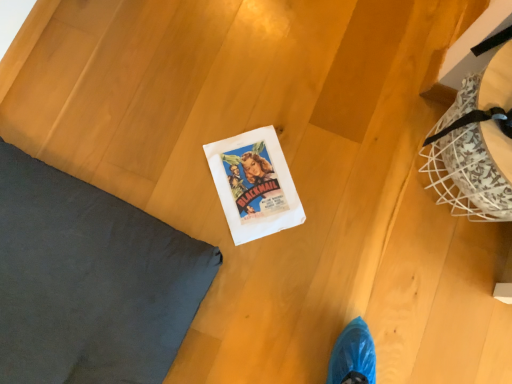
Question: Considering the relative sizes of white paper comic book at center and dark gray fabric pillow at upper left in the image provided, is white paper comic book at center taller than dark gray fabric pillow at upper left?

Choices:
 (A) yes
 (B) no

Answer: (B)

Question: Is white paper comic book at center aimed at dark gray fabric pillow at upper left?

Choices:
 (A) no
 (B) yes

Answer: (A)

Question: Is white paper comic book at center to the right of dark gray fabric pillow at upper left from the viewer's perspective?

Choices:
 (A) yes
 (B) no

Answer: (A)

Question: From the image's perspective, is white paper comic book at center beneath dark gray fabric pillow at upper left?

Choices:
 (A) yes
 (B) no

Answer: (B)

Question: Does white paper comic book at center have a smaller size compared to dark gray fabric pillow at upper left?

Choices:
 (A) no
 (B) yes

Answer: (B)

Question: Considering the relative sizes of white paper comic book at center and dark gray fabric pillow at upper left in the image provided, is white paper comic book at center bigger than dark gray fabric pillow at upper left?

Choices:
 (A) yes
 (B) no

Answer: (B)

Question: From a real-world perspective, is dark gray fabric pillow at upper left positioned under white paper comic book at center based on gravity?

Choices:
 (A) yes
 (B) no

Answer: (B)

Question: Is dark gray fabric pillow at upper left positioned in front of white paper comic book at center?

Choices:
 (A) no
 (B) yes

Answer: (B)

Question: Can you confirm if dark gray fabric pillow at upper left is thinner than white paper comic book at center?

Choices:
 (A) no
 (B) yes

Answer: (A)

Question: Is dark gray fabric pillow at upper left further to the viewer compared to white paper comic book at center?

Choices:
 (A) yes
 (B) no

Answer: (B)

Question: Could you tell me if dark gray fabric pillow at upper left is facing white paper comic book at center?

Choices:
 (A) yes
 (B) no

Answer: (B)

Question: Is dark gray fabric pillow at upper left not close to white paper comic book at center?

Choices:
 (A) yes
 (B) no

Answer: (B)

Question: Considering the positions of white paper comic book at center and dark gray fabric pillow at upper left in the image, is white paper comic book at center wider or thinner than dark gray fabric pillow at upper left?

Choices:
 (A) wide
 (B) thin

Answer: (B)